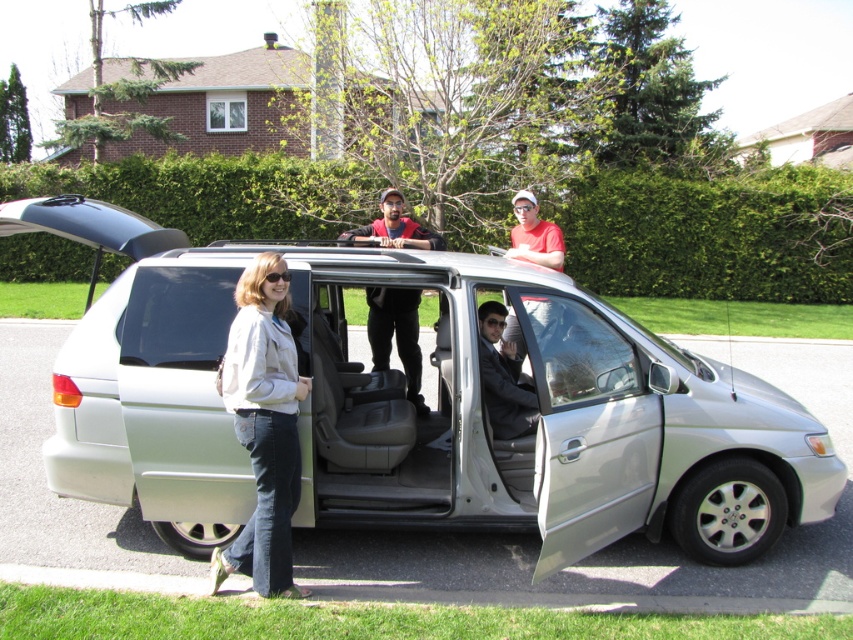
Does denim jeans at lower left have a greater height compared to dark gray suit at center?

Indeed, denim jeans at lower left has a greater height compared to dark gray suit at center.

This screenshot has height=640, width=853. What are the coordinates of `denim jeans at lower left` in the screenshot? It's located at (264, 426).

Does point (236, 540) lie behind point (506, 404)?

No.

At what (x,y) coordinates should I click in order to perform the action: click on denim jeans at lower left. Please return your answer as a coordinate pair (x, y). The width and height of the screenshot is (853, 640). Looking at the image, I should click on (264, 426).

Is point (622, 461) behind point (273, 579)?

Yes, it is.

Does point (125, 385) come closer to viewer compared to point (276, 272)?

No, it is behind (276, 272).

The width and height of the screenshot is (853, 640). Describe the element at coordinates (413, 408) in the screenshot. I see `silver metallic minivan at center` at that location.

This screenshot has height=640, width=853. I want to click on silver metallic minivan at center, so click(413, 408).

Which is above, denim jeans at lower left or matte red shirt at upper center?

matte red shirt at upper center is higher up.

Between point (262, 540) and point (535, 218), which one is positioned in front?

Point (262, 540)

Does point (277, 349) lie in front of point (541, 244)?

Yes, point (277, 349) is in front of point (541, 244).

The image size is (853, 640). What are the coordinates of `denim jeans at lower left` in the screenshot? It's located at (264, 426).